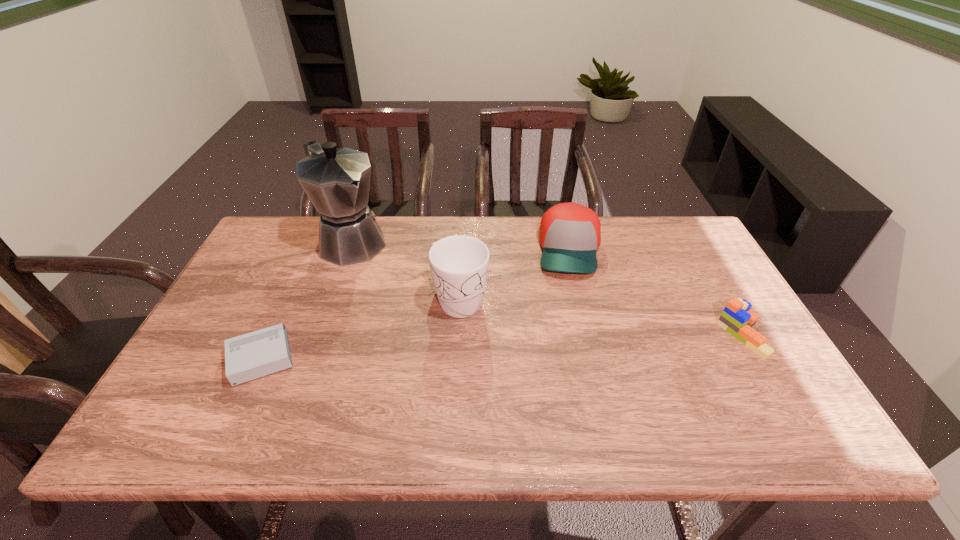
Find the location of `baseball cap positioned at the far edge`. baseball cap positioned at the far edge is located at coordinates tap(570, 234).

Where is `object that is at the near edge`? object that is at the near edge is located at coordinates (256, 354).

Where is `object that is at the left edge`? This screenshot has width=960, height=540. object that is at the left edge is located at coordinates (256, 354).

Where is `object located at the right edge`? This screenshot has width=960, height=540. object located at the right edge is located at coordinates (737, 319).

I want to click on object at the near left corner, so click(256, 354).

Identify the location of vacant point at the far edge. The width and height of the screenshot is (960, 540). (526, 232).

Where is `vacant space at the near edge of the desktop`? vacant space at the near edge of the desktop is located at coordinates (406, 374).

Where is `free space at the left edge`? The width and height of the screenshot is (960, 540). free space at the left edge is located at coordinates (252, 281).

I want to click on free location at the right edge of the desktop, so click(726, 291).

In the image, there is a desktop. At what (x,y) coordinates should I click in order to perform the action: click on vacant space at the far left corner. Please return your answer as a coordinate pair (x, y). The height and width of the screenshot is (540, 960). Looking at the image, I should click on (312, 227).